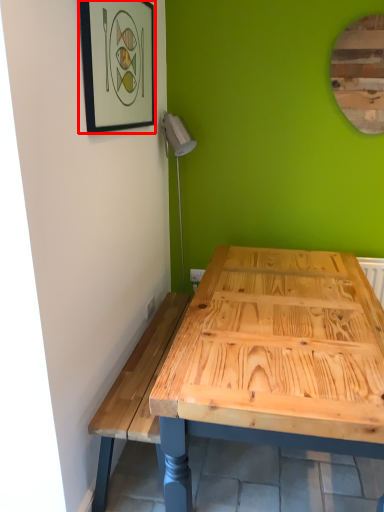
Question: From the image's perspective, where is picture frame (annotated by the red box) located in relation to mirror in the image?

Choices:
 (A) above
 (B) below

Answer: (B)